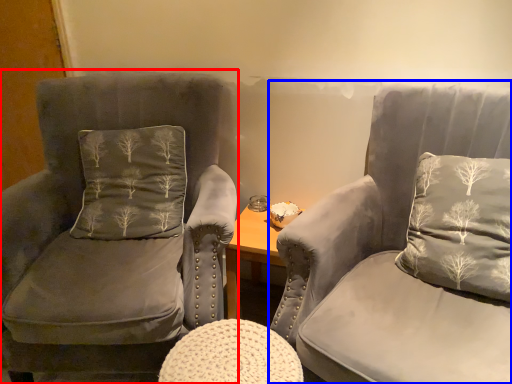
Question: Which object appears farthest to the camera in this image, chair (highlighted by a red box) or chair (highlighted by a blue box)?

Choices:
 (A) chair
 (B) chair

Answer: (A)